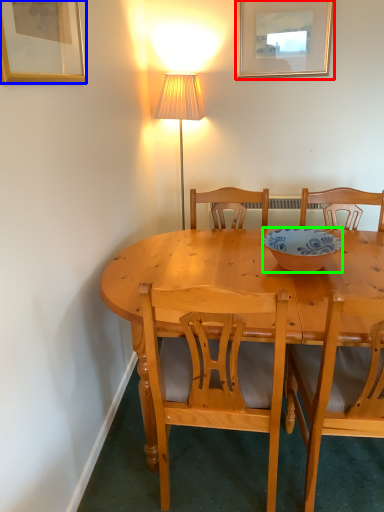
Question: Considering the real-world distances, which object is closest to picture frame (highlighted by a red box)? picture frame (highlighted by a blue box) or bowl (highlighted by a green box).

Choices:
 (A) picture frame
 (B) bowl

Answer: (B)